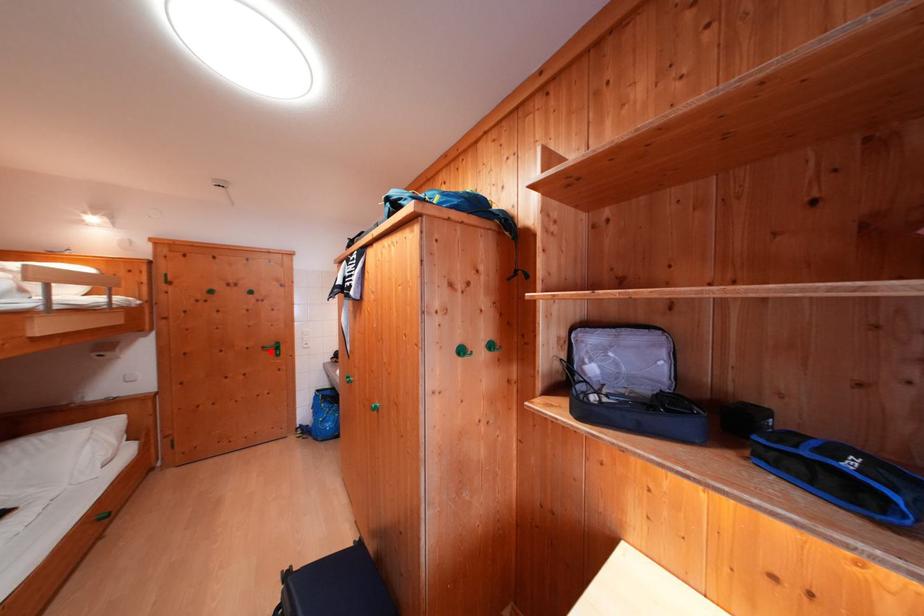
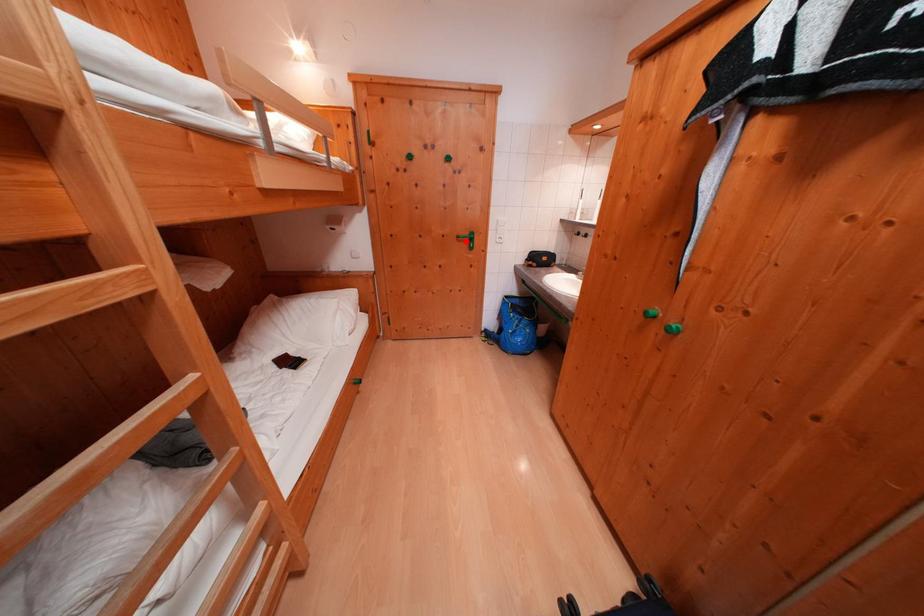
I am providing you with two images of the same scene from different viewpoints. A red point is marked on the first image and another point is marked on the second image. Does the point marked in image1 correspond to the same location as the one in image2?

Yes